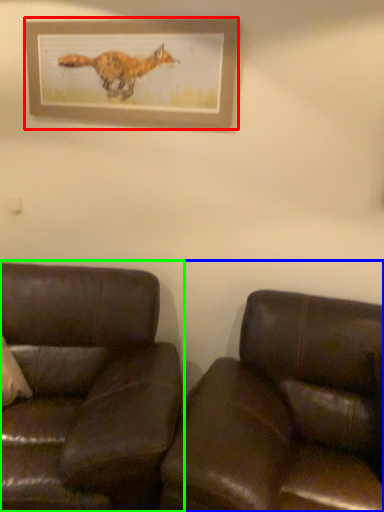
Question: Based on their relative distances, which object is farther from picture frame (highlighted by a red box)? Choose from studio couch (highlighted by a blue box) and studio couch (highlighted by a green box).

Choices:
 (A) studio couch
 (B) studio couch

Answer: (A)